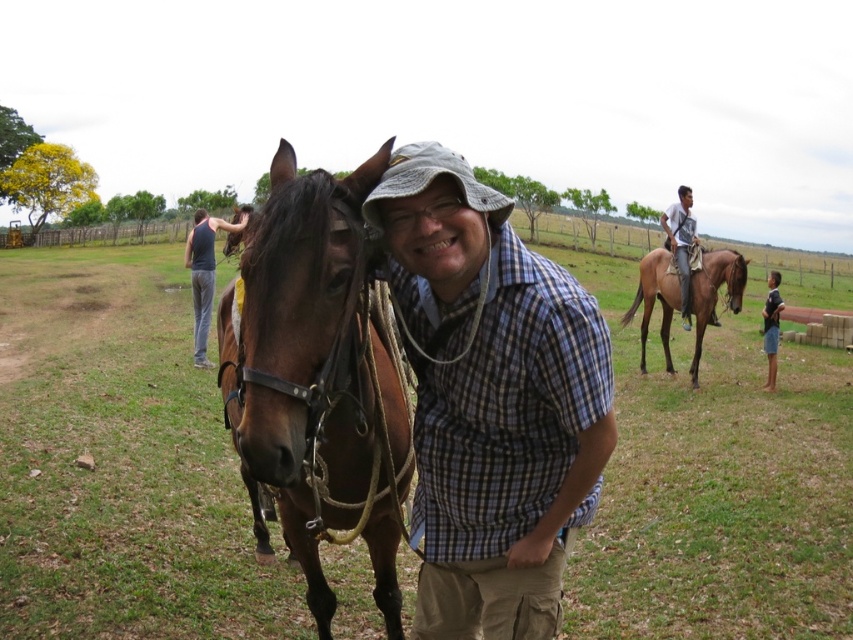
Between matte plaid shirt at center and brown glossy horse at right, which one is positioned lower?

matte plaid shirt at center

Identify the location of matte plaid shirt at center. (491, 401).

The width and height of the screenshot is (853, 640). I want to click on matte plaid shirt at center, so click(x=491, y=401).

Is brown leather horse at center below dark gray tank top at left?

Yes.

Is brown leather horse at center thinner than dark gray tank top at left?

Yes, brown leather horse at center is thinner than dark gray tank top at left.

Locate an element on the screen. This screenshot has width=853, height=640. brown leather horse at center is located at coordinates (317, 376).

The image size is (853, 640). Identify the location of brown leather horse at center. (317, 376).

Who is more distant from viewer, (467,296) or (381,515)?

The point (381,515) is behind.

Based on the photo, does matte plaid shirt at center have a lesser width compared to brown leather horse at center?

Yes.

Image resolution: width=853 pixels, height=640 pixels. Describe the element at coordinates (491, 401) in the screenshot. I see `matte plaid shirt at center` at that location.

Locate an element on the screen. matte plaid shirt at center is located at coordinates (491, 401).